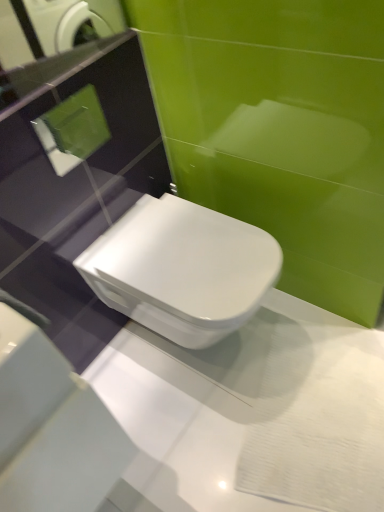
Find the location of a particular element. Image resolution: width=384 pixels, height=512 pixels. glossy glass mirror at upper left is located at coordinates (56, 59).

Describe the element at coordinates (56, 59) in the screenshot. Image resolution: width=384 pixels, height=512 pixels. I see `glossy glass mirror at upper left` at that location.

Identify the location of white glossy toilet at center. (182, 269).

The image size is (384, 512). Describe the element at coordinates (182, 269) in the screenshot. I see `white glossy toilet at center` at that location.

Measure the distance between point (x=192, y=257) and camera.

Point (x=192, y=257) is 3.80 feet away from camera.

The image size is (384, 512). I want to click on glossy glass mirror at upper left, so click(56, 59).

Based on their positions, is glossy glass mirror at upper left located to the left or right of white glossy toilet at center?

From the image, it's evident that glossy glass mirror at upper left is to the left of white glossy toilet at center.

Which object is closer to the camera taking this photo, glossy glass mirror at upper left or white glossy toilet at center?

glossy glass mirror at upper left is more forward.

Is point (4, 91) closer to viewer compared to point (192, 294)?

Yes, point (4, 91) is in front of point (192, 294).

From the image's perspective, would you say glossy glass mirror at upper left is shown under white glossy toilet at center?

Incorrect, from the image's perspective, glossy glass mirror at upper left is higher than white glossy toilet at center.

From a real-world perspective, is glossy glass mirror at upper left above or below white glossy toilet at center?

glossy glass mirror at upper left is above white glossy toilet at center.

Can you confirm if glossy glass mirror at upper left is wider than white glossy toilet at center?

Incorrect, the width of glossy glass mirror at upper left does not surpass that of white glossy toilet at center.

Who is shorter, glossy glass mirror at upper left or white glossy toilet at center?

glossy glass mirror at upper left is shorter.

Considering the relative sizes of glossy glass mirror at upper left and white glossy toilet at center in the image provided, is glossy glass mirror at upper left smaller than white glossy toilet at center?

Correct, glossy glass mirror at upper left occupies less space than white glossy toilet at center.

Is glossy glass mirror at upper left not inside white glossy toilet at center?

Yes, glossy glass mirror at upper left is not within white glossy toilet at center.

Is glossy glass mirror at upper left not close to white glossy toilet at center?

Actually, glossy glass mirror at upper left and white glossy toilet at center are a little close together.

From the picture: Could you tell me if glossy glass mirror at upper left is facing white glossy toilet at center?

No, glossy glass mirror at upper left is not aimed at white glossy toilet at center.

What's the angular difference between glossy glass mirror at upper left and white glossy toilet at center's facing directions?

23.5 degrees.

The image size is (384, 512). I want to click on toilet located behind the glossy glass mirror at upper left, so click(182, 269).

Which object is positioned more to the right, white glossy toilet at center or glossy glass mirror at upper left?

Positioned to the right is white glossy toilet at center.

Is white glossy toilet at center in front of or behind glossy glass mirror at upper left in the image?

Visually, white glossy toilet at center is located behind glossy glass mirror at upper left.

Between point (172, 232) and point (18, 27), which one is positioned behind?

Positioned behind is point (18, 27).

From the image's perspective, between white glossy toilet at center and glossy glass mirror at upper left, who is located below?

white glossy toilet at center, from the image's perspective.

From a real-world perspective, is white glossy toilet at center positioned under glossy glass mirror at upper left based on gravity?

Indeed, from a real-world perspective, white glossy toilet at center is positioned beneath glossy glass mirror at upper left.

Can you confirm if white glossy toilet at center is wider than glossy glass mirror at upper left?

Correct, the width of white glossy toilet at center exceeds that of glossy glass mirror at upper left.

Which of these two, white glossy toilet at center or glossy glass mirror at upper left, stands shorter?

With less height is glossy glass mirror at upper left.

Between white glossy toilet at center and glossy glass mirror at upper left, which one has larger size?

With larger size is white glossy toilet at center.

Is white glossy toilet at center not within glossy glass mirror at upper left?

That's correct, white glossy toilet at center is outside of glossy glass mirror at upper left.

In the scene shown: Is white glossy toilet at center directly adjacent to glossy glass mirror at upper left?

No.

Is white glossy toilet at center positioned with its back to glossy glass mirror at upper left?

white glossy toilet at center does not have its back to glossy glass mirror at upper left.

This screenshot has width=384, height=512. I want to click on toilet below the glossy glass mirror at upper left (from a real-world perspective), so click(182, 269).

The width and height of the screenshot is (384, 512). Identify the location of mirror lying above the white glossy toilet at center (from the image's perspective). (56, 59).

Where is `mirror located above the white glossy toilet at center (from a real-world perspective)`? This screenshot has height=512, width=384. mirror located above the white glossy toilet at center (from a real-world perspective) is located at coordinates (56, 59).